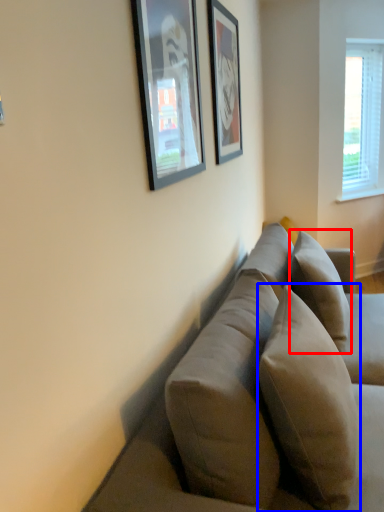
Question: Which of the following is the closest to the observer, pillow (highlighted by a red box) or pillow (highlighted by a blue box)?

Choices:
 (A) pillow
 (B) pillow

Answer: (B)